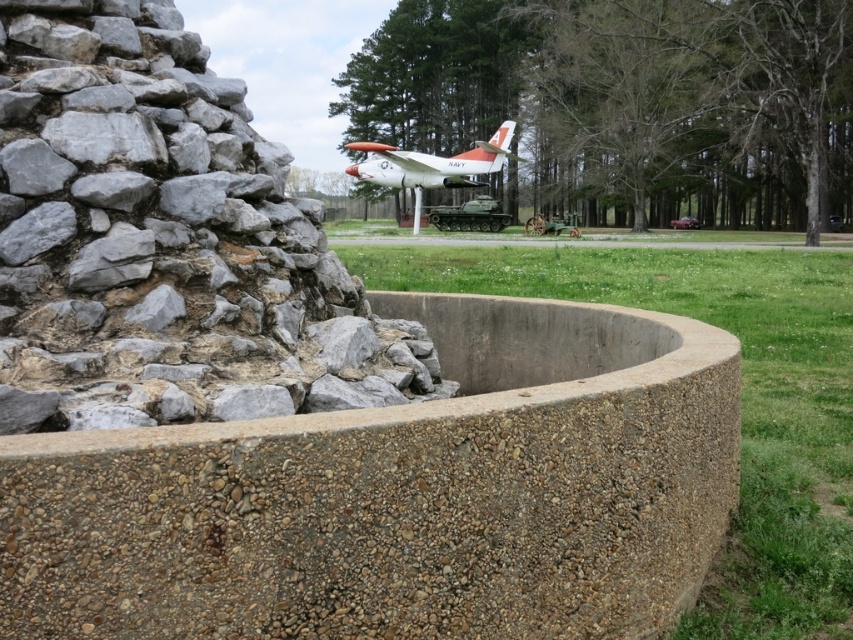
Can you confirm if gray concrete basin at center is smaller than orange matte airplane at center?

Correct, gray concrete basin at center occupies less space than orange matte airplane at center.

Is point (624, 310) positioned in front of point (494, 170)?

Yes.

Locate an element on the screen. Image resolution: width=853 pixels, height=640 pixels. gray concrete basin at center is located at coordinates (401, 493).

Is gray rough stone at left above orange matte airplane at center?

Incorrect, gray rough stone at left is not positioned above orange matte airplane at center.

Does gray rough stone at left appear on the right side of orange matte airplane at center?

Yes, gray rough stone at left is to the right of orange matte airplane at center.

Is point (387, 400) less distant than point (442, 170)?

Yes.

Locate an element on the screen. The height and width of the screenshot is (640, 853). gray rough stone at left is located at coordinates (164, 241).

Locate an element on the screen. gray concrete basin at center is located at coordinates (401, 493).

Between gray concrete basin at center and gray rough stone at left, which one has more height?

gray rough stone at left

Who is more forward, (268, 582) or (0, 296)?

Point (268, 582) is more forward.

Identify the location of gray concrete basin at center. [401, 493].